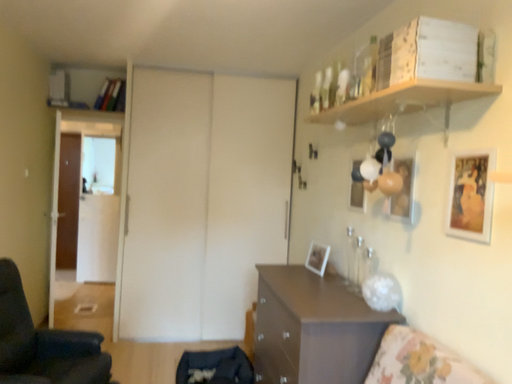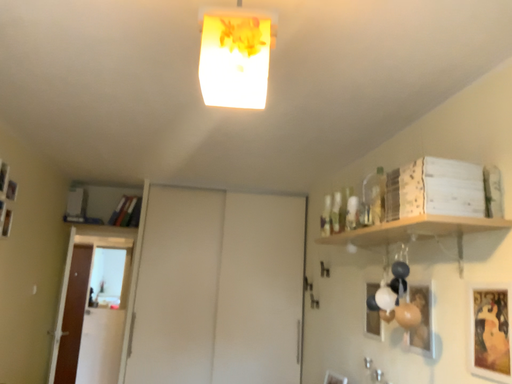
Question: How did the camera likely rotate when shooting the video?

Choices:
 (A) rotated downward
 (B) rotated upward

Answer: (B)